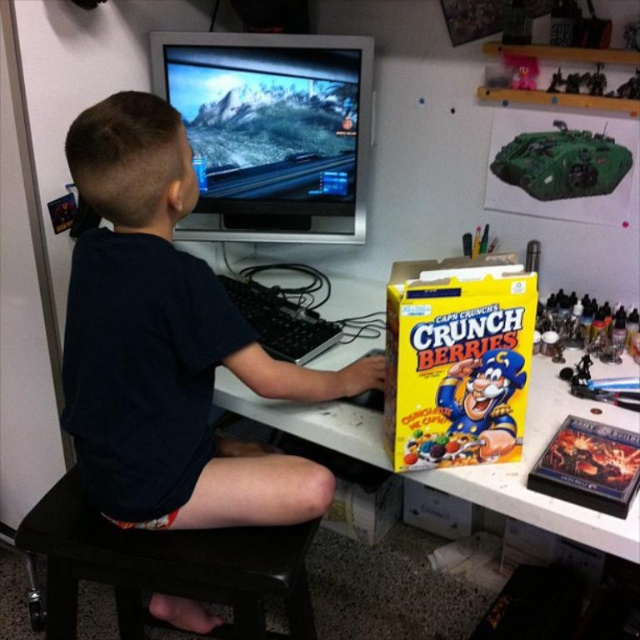
Does satin black monitor at upper center come behind green matte tank at upper right?

Yes, satin black monitor at upper center is behind green matte tank at upper right.

Between satin black monitor at upper center and green matte tank at upper right, which one has more height?

Standing taller between the two is satin black monitor at upper center.

This screenshot has height=640, width=640. What do you see at coordinates (272, 131) in the screenshot?
I see `satin black monitor at upper center` at bounding box center [272, 131].

The height and width of the screenshot is (640, 640). Identify the location of satin black monitor at upper center. (272, 131).

Between satin black monitor at upper center and yellow cardboard box at center, which one has more height?

Standing taller between the two is satin black monitor at upper center.

Does satin black monitor at upper center have a greater height compared to yellow cardboard box at center?

Correct, satin black monitor at upper center is much taller as yellow cardboard box at center.

Is point (291, 230) positioned in front of point (333, 362)?

No, it is behind (333, 362).

Locate an element on the screen. The height and width of the screenshot is (640, 640). satin black monitor at upper center is located at coordinates (272, 131).

Does point (144, 461) lie in front of point (296, 604)?

Yes, point (144, 461) is closer to viewer.

Does point (128, 220) come farther from viewer compared to point (186, 577)?

No, it is in front of (186, 577).

Locate an element on the screen. dark blue shirt at center is located at coordinates (170, 346).